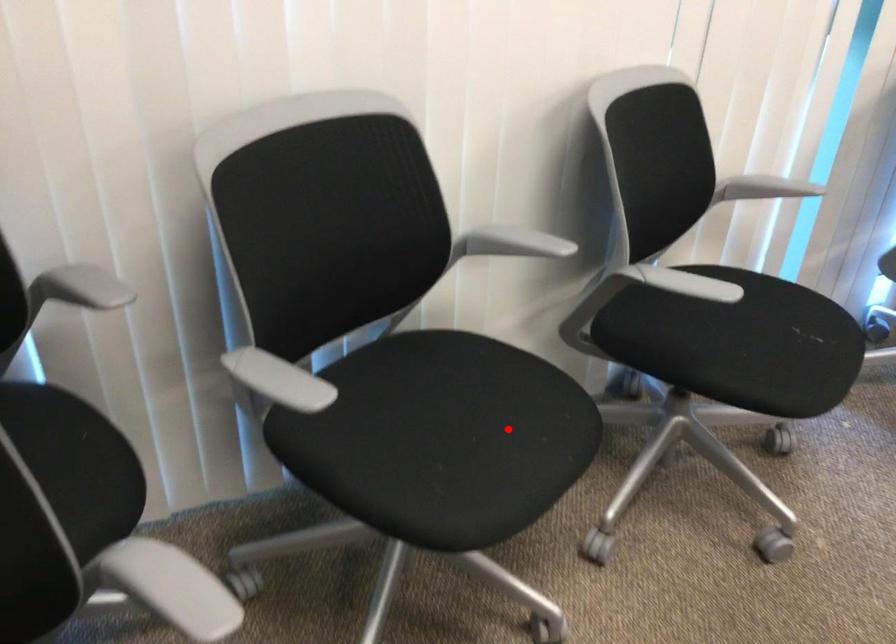
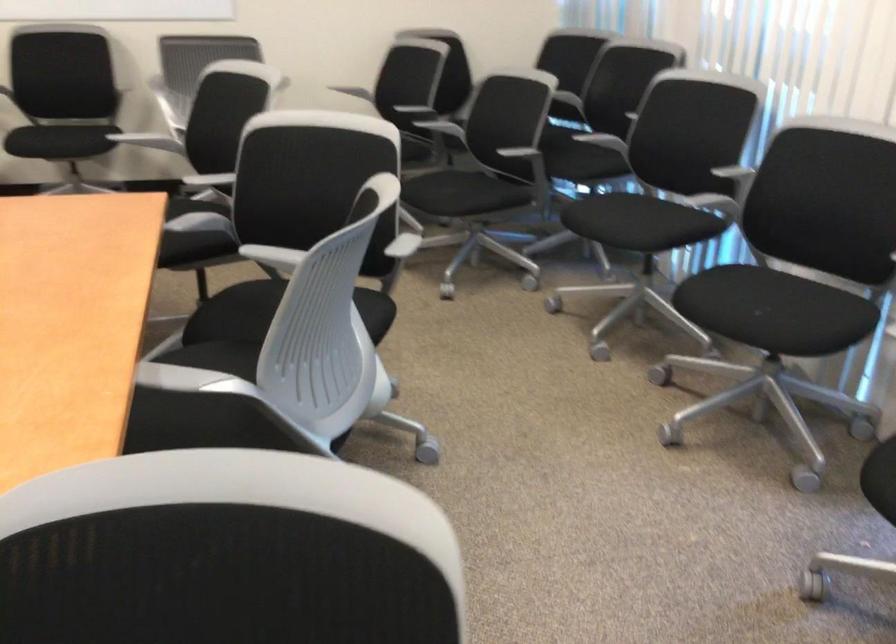
Locate, in the second image, the point that corresponds to the highlighted location in the first image.

(624, 221)